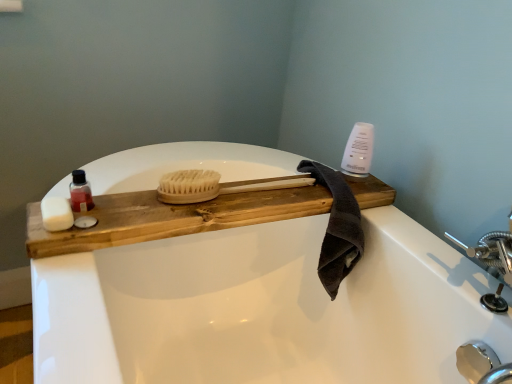
Question: Considering the relative sizes of white matte soap at left, which appears as the first soap when viewed from the left, and natural wood tray at center in the image provided, is white matte soap at left, which appears as the first soap when viewed from the left, taller than natural wood tray at center?

Choices:
 (A) yes
 (B) no

Answer: (B)

Question: Considering the relative sizes of white matte soap at left, arranged as the second soap when viewed from the right, and natural wood tray at center in the image provided, is white matte soap at left, arranged as the second soap when viewed from the right, wider than natural wood tray at center?

Choices:
 (A) yes
 (B) no

Answer: (B)

Question: From the image's perspective, is white matte soap at left, arranged as the second soap when viewed from the right, under natural wood tray at center?

Choices:
 (A) yes
 (B) no

Answer: (A)

Question: Are white matte soap at left, arranged as the second soap when viewed from the right, and natural wood tray at center beside each other?

Choices:
 (A) no
 (B) yes

Answer: (A)

Question: Does white matte soap at left, which appears as the first soap when viewed from the left, appear on the left side of natural wood tray at center?

Choices:
 (A) no
 (B) yes

Answer: (B)

Question: Is natural wood brush at center situated inside white matte soap at left, arranged as the second soap when viewed from the right, or outside?

Choices:
 (A) inside
 (B) outside

Answer: (B)

Question: From the image's perspective, is natural wood brush at center positioned above or below white matte soap at left, arranged as the second soap when viewed from the right?

Choices:
 (A) below
 (B) above

Answer: (B)

Question: In terms of size, does natural wood brush at center appear bigger or smaller than white matte soap at left, arranged as the second soap when viewed from the right?

Choices:
 (A) small
 (B) big

Answer: (B)

Question: Is point (187, 173) positioned closer to the camera than point (42, 205)?

Choices:
 (A) closer
 (B) farther

Answer: (B)

Question: Is white glossy bottle at upper right wider or thinner than dark gray cotton towel at upper right?

Choices:
 (A) wide
 (B) thin

Answer: (B)

Question: Considering the relative positions of white glossy bottle at upper right and dark gray cotton towel at upper right in the image provided, is white glossy bottle at upper right to the left or to the right of dark gray cotton towel at upper right?

Choices:
 (A) left
 (B) right

Answer: (B)

Question: Does point (355, 152) appear closer or farther from the camera than point (352, 233)?

Choices:
 (A) farther
 (B) closer

Answer: (A)

Question: From a real-world perspective, is white glossy bottle at upper right above or below dark gray cotton towel at upper right?

Choices:
 (A) below
 (B) above

Answer: (B)

Question: Is point (95, 221) positioned closer to the camera than point (262, 208)?

Choices:
 (A) closer
 (B) farther

Answer: (A)

Question: Which is correct: white matte soap at left, marked as the 2th soap in a left-to-right arrangement, is inside natural wood tray at center, or outside of it?

Choices:
 (A) inside
 (B) outside

Answer: (A)